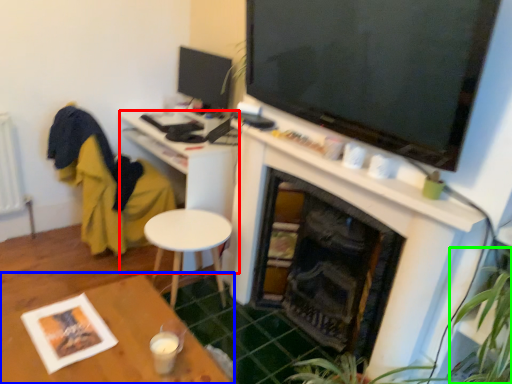
Question: Based on their relative distances, which object is farther from desk (highlighted by a red box)? Choose from table (highlighted by a blue box) and plant (highlighted by a green box).

Choices:
 (A) table
 (B) plant

Answer: (B)